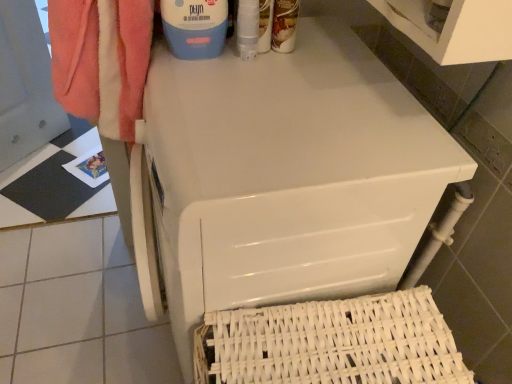
Question: From their relative heights in the image, would you say white woven basket at lower right is taller or shorter than white glossy washing machine at upper center?

Choices:
 (A) tall
 (B) short

Answer: (B)

Question: Choose the correct answer: Is white woven basket at lower right inside white glossy washing machine at upper center or outside it?

Choices:
 (A) inside
 (B) outside

Answer: (B)

Question: Which object is positioned closest to the matte brown bottle at upper center, the second cleaning product viewed from the left?

Choices:
 (A) white woven basket at lower right
 (B) white glossy washing machine at upper center
 (C) blue plastic container at upper center, which is counted as the 1th cleaning product, starting from the left

Answer: (C)

Question: Estimate the real-world distances between objects in this image. Which object is farther from the matte brown bottle at upper center, the second cleaning product viewed from the left?

Choices:
 (A) blue plastic container at upper center, acting as the 2th cleaning product starting from the right
 (B) white woven basket at lower right
 (C) white glossy washing machine at upper center

Answer: (B)